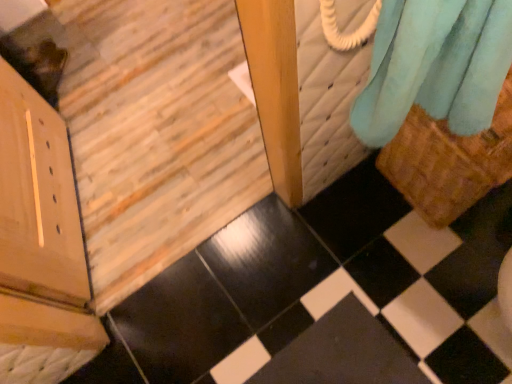
Question: Is soft blue fabric at upper right a part of wooden door at lower left?

Choices:
 (A) yes
 (B) no

Answer: (B)

Question: Can you confirm if wooden door at lower left is wider than soft blue fabric at upper right?

Choices:
 (A) no
 (B) yes

Answer: (A)

Question: From a real-world perspective, is wooden door at lower left located beneath soft blue fabric at upper right?

Choices:
 (A) no
 (B) yes

Answer: (B)

Question: Is wooden door at lower left smaller than soft blue fabric at upper right?

Choices:
 (A) no
 (B) yes

Answer: (A)

Question: From the image's perspective, would you say wooden door at lower left is shown under soft blue fabric at upper right?

Choices:
 (A) no
 (B) yes

Answer: (B)

Question: From a real-world perspective, is wooden door at lower left positioned above or below soft blue fabric at upper right?

Choices:
 (A) above
 (B) below

Answer: (B)

Question: Based on their positions, is wooden door at lower left located to the left or right of soft blue fabric at upper right?

Choices:
 (A) right
 (B) left

Answer: (B)

Question: Is wooden door at lower left inside the boundaries of soft blue fabric at upper right, or outside?

Choices:
 (A) outside
 (B) inside

Answer: (A)

Question: Based on their sizes in the image, would you say wooden door at lower left is bigger or smaller than soft blue fabric at upper right?

Choices:
 (A) small
 (B) big

Answer: (B)

Question: From a real-world perspective, relative to black glossy tile at lower right, is wooden door at lower left vertically above or below?

Choices:
 (A) below
 (B) above

Answer: (B)

Question: Is wooden door at lower left wider or thinner than black glossy tile at lower right?

Choices:
 (A) thin
 (B) wide

Answer: (A)

Question: Would you say wooden door at lower left is to the left or to the right of black glossy tile at lower right in the picture?

Choices:
 (A) right
 (B) left

Answer: (B)

Question: Is wooden door at lower left taller or shorter than black glossy tile at lower right?

Choices:
 (A) tall
 (B) short

Answer: (A)

Question: Looking at the image, does soft blue fabric at upper right seem bigger or smaller compared to wooden door at lower left?

Choices:
 (A) big
 (B) small

Answer: (B)

Question: Is point (496, 16) positioned closer to the camera than point (111, 130)?

Choices:
 (A) closer
 (B) farther

Answer: (A)